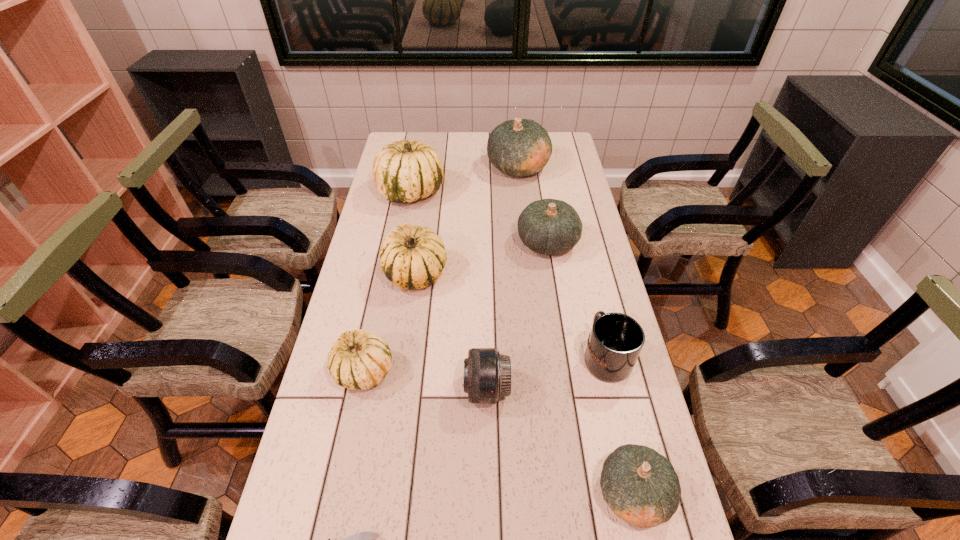
The height and width of the screenshot is (540, 960). I want to click on orange gourd that stands as the second closest to the nearest orange gourd, so click(x=521, y=147).

Choose which orange gourd is the nearest neighbor to the second smallest orange gourd. Please provide its 2D coordinates. Your answer should be formatted as a tuple, i.e. [(x, y)], where the tuple contains the x and y coordinates of a point satisfying the conditions above.

[(521, 147)]

In order to click on white gourd identified as the closest to the second biggest white gourd in this screenshot , I will do `click(358, 360)`.

Find the location of a particular element. This screenshot has width=960, height=540. white gourd that can be found as the closest to the shortest object is located at coordinates (358, 360).

Where is `vacant point that satisfies the following two spatial constraints: 1. on the front side of the farthest white gourd; 2. on the left side of the nearest orange gourd`? This screenshot has width=960, height=540. vacant point that satisfies the following two spatial constraints: 1. on the front side of the farthest white gourd; 2. on the left side of the nearest orange gourd is located at coordinates (354, 494).

Image resolution: width=960 pixels, height=540 pixels. In order to click on vacant space that satisfies the following two spatial constraints: 1. on the front-facing side of the nearest gourd; 2. on the left side of the telephoto lens in this screenshot , I will do `click(488, 494)`.